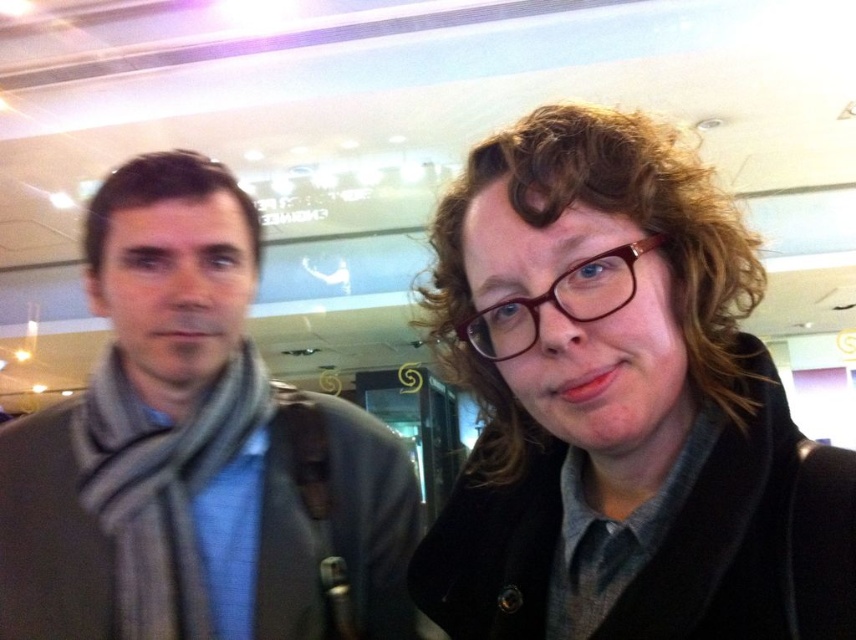
You are standing in the shopping mall and see the matte black coat at right. If you want to walk directly towards it from your current position, what coordinates should you aim for?

The coordinates to aim for are 0.633 on the x axis and 0.729 on the y axis, as the matte black coat at right is located at point (623, 404).

You are holding a camera and want to take a closeup photo of the gray wool scarf at left. The camera requires at least 24 inches of space to focus properly. Is the current distance sufficient?

The gray wool scarf at left is 30.81 inches away from the camera, which is more than the required 24 inches. Therefore, the distance is sufficient for the camera to focus properly.